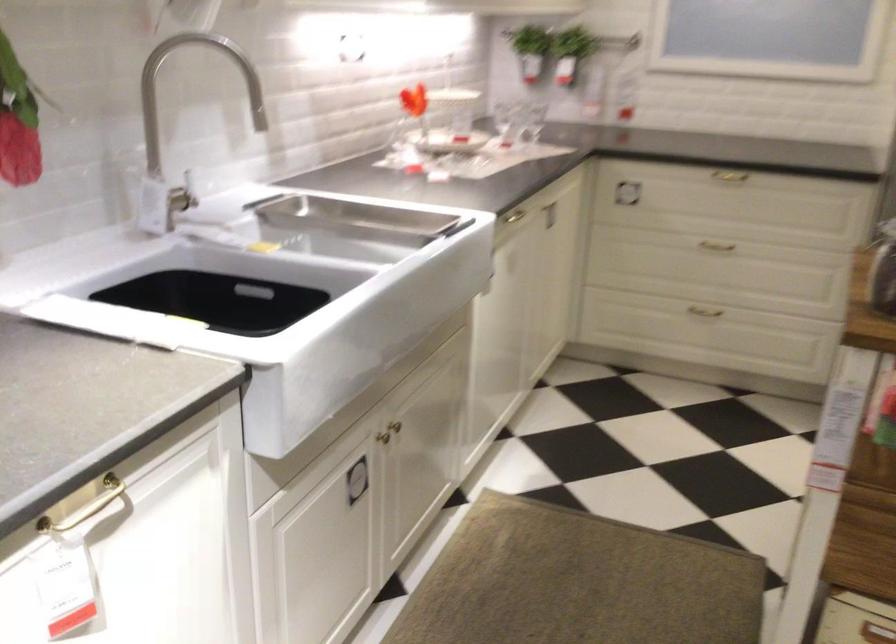
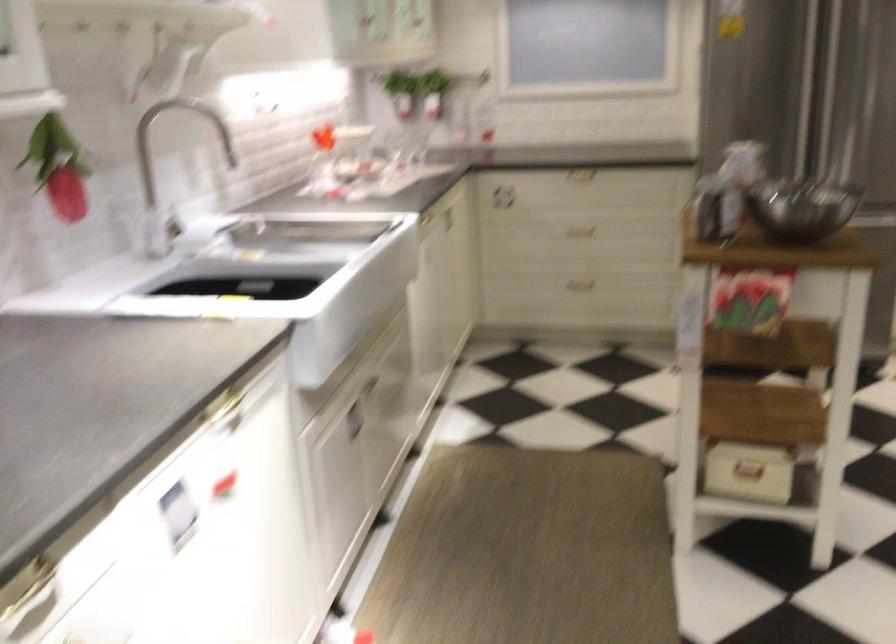
Question: The first image is from the beginning of the video and the second image is from the end. How did the camera likely rotate when shooting the video?

Choices:
 (A) Left
 (B) Right
 (C) Up
 (D) Down

Answer: (B)